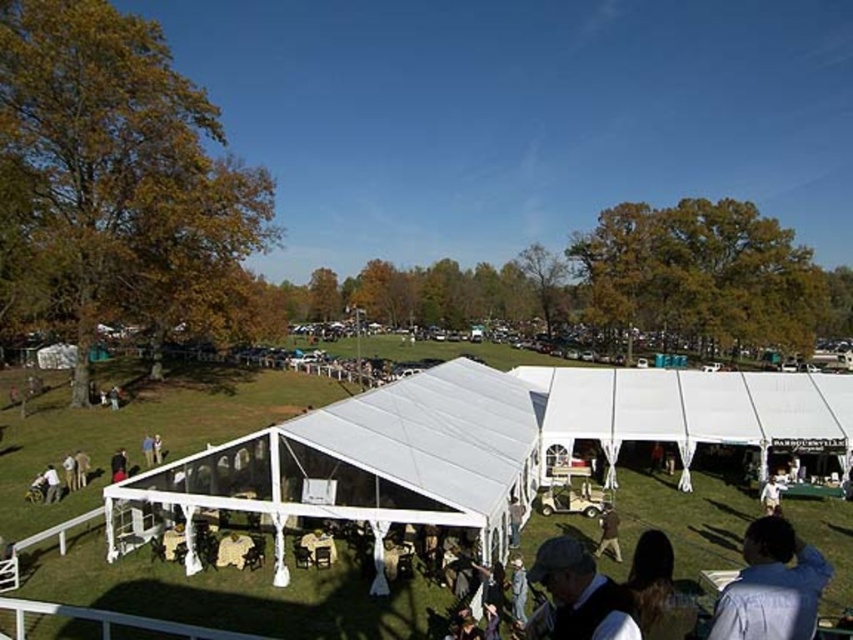
You are standing at the center of the grassy area and want to locate the blue shirt at lower right. Which direction should you look to find it?

You should look to the lower right direction to find the blue shirt at lower right as it is located at point (770, 586).

You are a guest at this outdoor event and want to pick up both the matte gray hat at lower center and the light brown leather jacket at center. However, you can only carry one item at a time. If you want to pick up the taller item first, which one should you choose?

The light brown leather jacket at center is taller than the matte gray hat at lower center, so you should pick up the light brown leather jacket at center first.

You are a photographer positioned at the center of the grassy area. You want to capture a photo that includes both the blue shirt at lower right and the matte gray hat at lower center. What is the minimum distance you need to move to ensure both subjects are in frame?

The blue shirt at lower right and the matte gray hat at lower center are 2.93 meters apart. To include both in the frame, you need to move back until the camera can capture a wide enough angle to encompass the 2.93 meters between them.